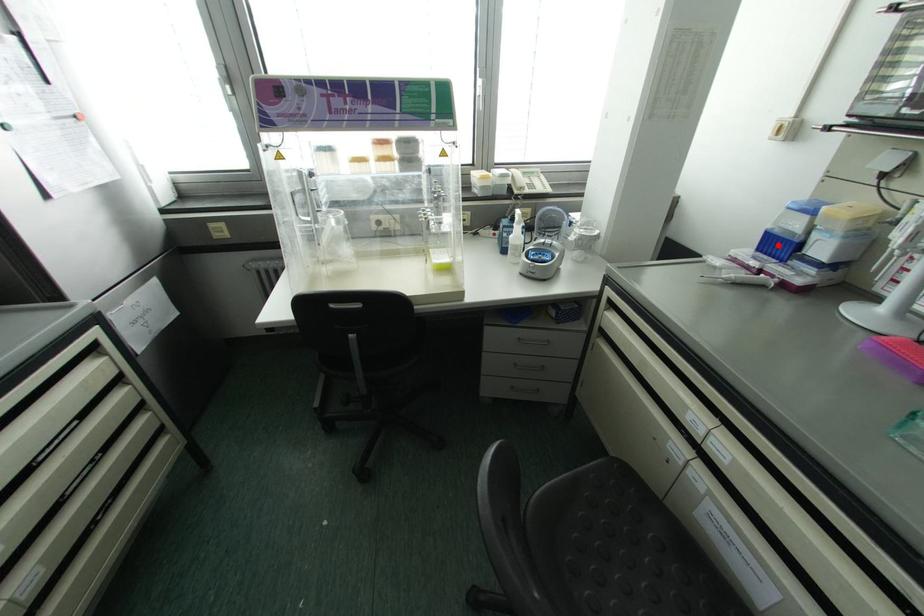
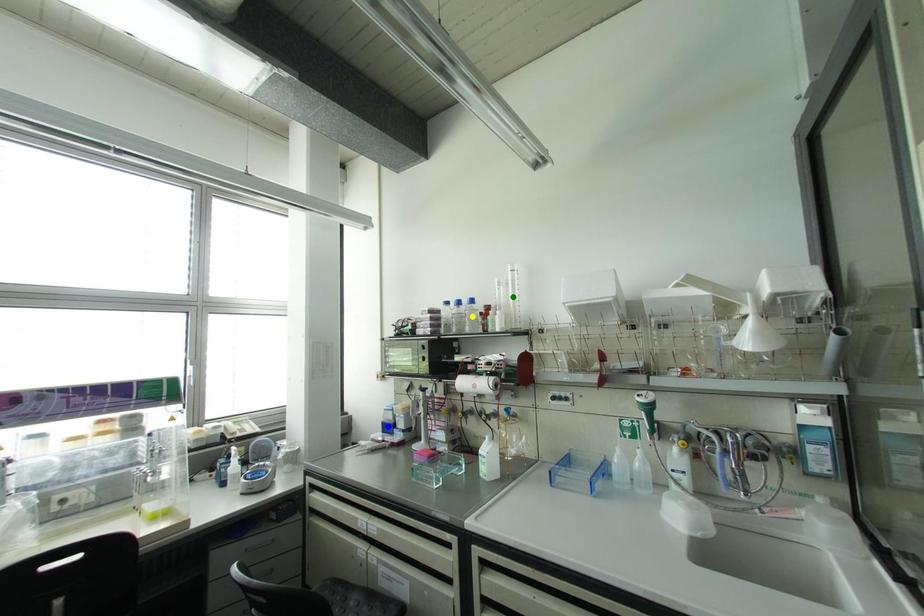
Question: I am providing you with two images of the same scene from different viewpoints. A red point is marked on the first image. You are given multiple points on the second image. Which mark in image 2 goes with the point in image 1?

Choices:
 (A) blue point
 (B) green point
 (C) yellow point

Answer: (A)